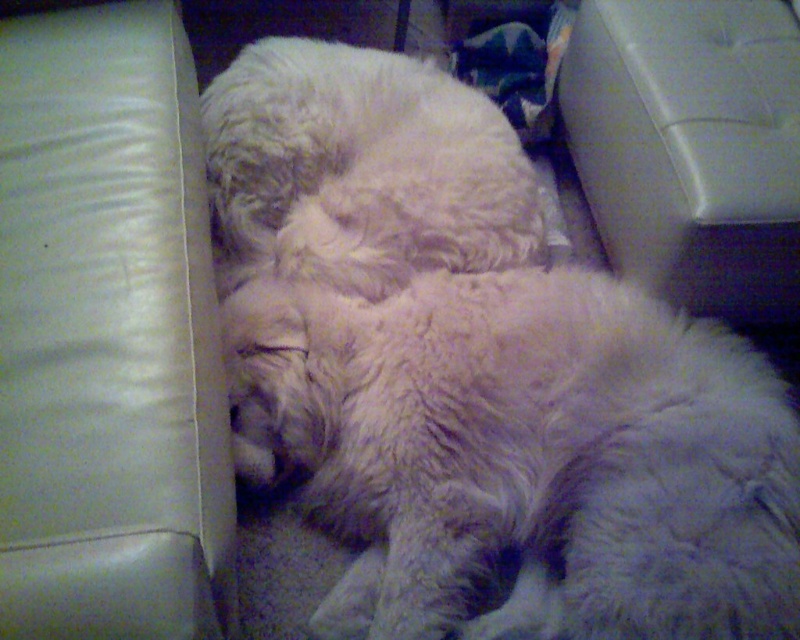
Is fluffy white cat at center to the left of fuzzy white dog at center from the viewer's perspective?

Correct, you'll find fluffy white cat at center to the left of fuzzy white dog at center.

Who is lower down, fluffy white cat at center or fuzzy white dog at center?

fluffy white cat at center is lower down.

Between point (666, 448) and point (752, 304), which one is positioned in front?

Positioned in front is point (666, 448).

The width and height of the screenshot is (800, 640). Identify the location of fluffy white cat at center. (532, 445).